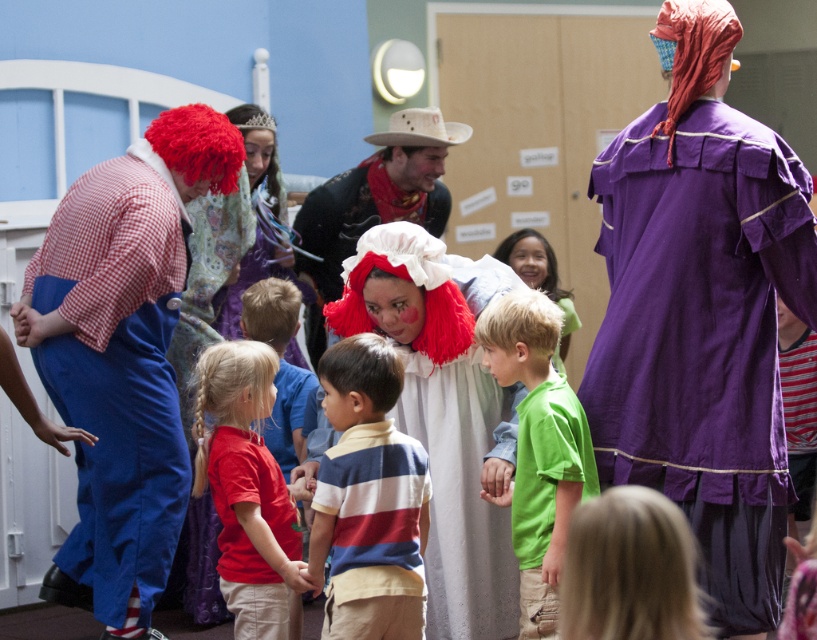
You are a photographer at the event and need to arrange the purple cotton dress at center and the striped cotton shirt at center for a photo. According to the current setup, which one is positioned to the right of the other?

The purple cotton dress at center is positioned to the right of the striped cotton shirt at center.

You are a photographer in the room and want to take a photo that includes both the striped cotton shirt at center and the red shirt at center. Which shirt should you focus on first to ensure both are in frame?

The striped cotton shirt at center is smaller than the red shirt at center, so you should focus on the red shirt at center first to ensure both are in frame.